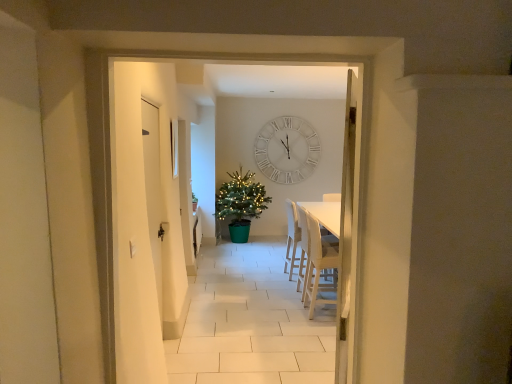
Question: Considering the positions of light beige fabric armchair at right, the 1th armchair positioned from the front, and white matte wall clock at center in the image, is light beige fabric armchair at right, the 1th armchair positioned from the front, wider or thinner than white matte wall clock at center?

Choices:
 (A) wide
 (B) thin

Answer: (A)

Question: Which is correct: light beige fabric armchair at right, the second armchair viewed from the back, is inside white matte wall clock at center, or outside of it?

Choices:
 (A) inside
 (B) outside

Answer: (B)

Question: Which of these objects is positioned farthest from the green plastic christmas tree at center?

Choices:
 (A) white fabric chair at center, which is counted as the first armchair, starting from the back
 (B) light beige fabric armchair at right, the 1th armchair positioned from the front
 (C) white matte door at left
 (D) white matte wall clock at center

Answer: (C)

Question: Which of these objects is positioned closest to the white matte door at left?

Choices:
 (A) light beige fabric armchair at right, the 1th armchair positioned from the front
 (B) white fabric chair at center, placed as the 2th armchair when sorted from front to back
 (C) white matte wall clock at center
 (D) green plastic christmas tree at center

Answer: (A)